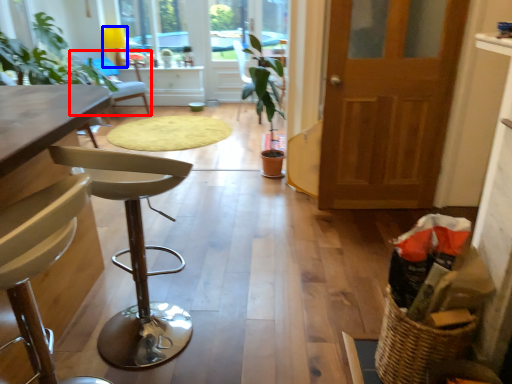
Question: Which object is further to the camera taking this photo, chair (highlighted by a red box) or lamp (highlighted by a blue box)?

Choices:
 (A) chair
 (B) lamp

Answer: (B)